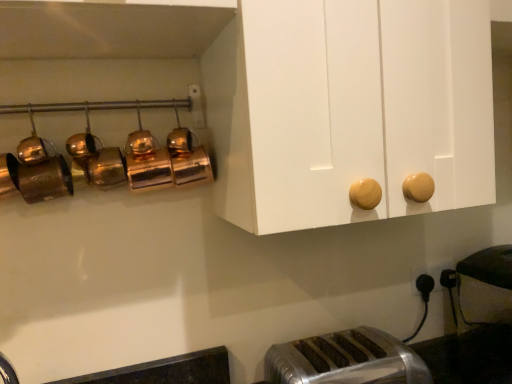
This screenshot has height=384, width=512. Find the location of `silver metallic toaster at lower center`. silver metallic toaster at lower center is located at coordinates (345, 360).

The width and height of the screenshot is (512, 384). What do you see at coordinates (345, 360) in the screenshot?
I see `silver metallic toaster at lower center` at bounding box center [345, 360].

In order to face black plastic outlet at lower right, should I rotate leftwards or rightwards?

Answer: To align with it, rotate right about 22.359°.

In the scene shown: What is the approximate width of black plastic outlet at lower right?

It is 1.20 centimeters.

This screenshot has height=384, width=512. Describe the element at coordinates (430, 273) in the screenshot. I see `black plastic outlet at lower right` at that location.

Where is `black plastic outlet at lower right`? black plastic outlet at lower right is located at coordinates (430, 273).

In order to click on silver metallic toaster at lower center in this screenshot , I will do `click(345, 360)`.

Which is more to the right, silver metallic toaster at lower center or black plastic outlet at lower right?

Positioned to the right is black plastic outlet at lower right.

In the image, is silver metallic toaster at lower center positioned in front of or behind black plastic outlet at lower right?

silver metallic toaster at lower center is positioned closer to the viewer than black plastic outlet at lower right.

Is point (310, 381) more distant than point (429, 272)?

That is False.

From the image's perspective, which is above, silver metallic toaster at lower center or black plastic outlet at lower right?

black plastic outlet at lower right appears higher in the image.

From a real-world perspective, does silver metallic toaster at lower center sit lower than black plastic outlet at lower right?

Yes.

Is silver metallic toaster at lower center thinner than black plastic outlet at lower right?

No.

Which of these two, silver metallic toaster at lower center or black plastic outlet at lower right, stands shorter?

black plastic outlet at lower right.

Is silver metallic toaster at lower center bigger or smaller than black plastic outlet at lower right?

In the image, silver metallic toaster at lower center appears to be larger than black plastic outlet at lower right.

Is silver metallic toaster at lower center not within black plastic outlet at lower right?

That's correct, silver metallic toaster at lower center is outside of black plastic outlet at lower right.

Is silver metallic toaster at lower center far from black plastic outlet at lower right?

No, there isn't a large distance between silver metallic toaster at lower center and black plastic outlet at lower right.

Is silver metallic toaster at lower center positioned with its back to black plastic outlet at lower right?

silver metallic toaster at lower center does not have its back to black plastic outlet at lower right.

The image size is (512, 384). What are the coordinates of `toaster in front of the black plastic outlet at lower right` in the screenshot? It's located at (345, 360).

Consider the image. Which is more to the right, black plastic outlet at lower right or silver metallic toaster at lower center?

From the viewer's perspective, black plastic outlet at lower right appears more on the right side.

Between black plastic outlet at lower right and silver metallic toaster at lower center, which one is positioned behind?

black plastic outlet at lower right is behind.

Between point (411, 274) and point (312, 358), which one is positioned behind?

The point (411, 274) is farther from the camera.

From the image's perspective, is black plastic outlet at lower right positioned above or below silver metallic toaster at lower center?

From the image's perspective, black plastic outlet at lower right appears above silver metallic toaster at lower center.

From a real-world perspective, is black plastic outlet at lower right positioned over silver metallic toaster at lower center based on gravity?

Yes.

Looking at their sizes, would you say black plastic outlet at lower right is wider or thinner than silver metallic toaster at lower center?

In the image, black plastic outlet at lower right appears to be more narrow than silver metallic toaster at lower center.

Considering the relative sizes of black plastic outlet at lower right and silver metallic toaster at lower center in the image provided, is black plastic outlet at lower right taller than silver metallic toaster at lower center?

No.

Considering the sizes of objects black plastic outlet at lower right and silver metallic toaster at lower center in the image provided, who is smaller, black plastic outlet at lower right or silver metallic toaster at lower center?

black plastic outlet at lower right.

Would you say black plastic outlet at lower right is outside silver metallic toaster at lower center?

Yes, black plastic outlet at lower right is outside of silver metallic toaster at lower center.

Is black plastic outlet at lower right next to silver metallic toaster at lower center and touching it?

No, black plastic outlet at lower right is not touching silver metallic toaster at lower center.

Could you tell me if black plastic outlet at lower right is facing silver metallic toaster at lower center?

No, black plastic outlet at lower right is not facing towards silver metallic toaster at lower center.

From the picture: Can you tell me how much black plastic outlet at lower right and silver metallic toaster at lower center differ in facing direction?

The angle between the facing direction of black plastic outlet at lower right and the facing direction of silver metallic toaster at lower center is 1.18 degrees.

The width and height of the screenshot is (512, 384). In order to click on toaster below the black plastic outlet at lower right (from the image's perspective) in this screenshot , I will do `click(345, 360)`.

Identify the location of electric outlet above the silver metallic toaster at lower center (from a real-world perspective). (430, 273).

This screenshot has height=384, width=512. Identify the location of toaster in front of the black plastic outlet at lower right. (345, 360).